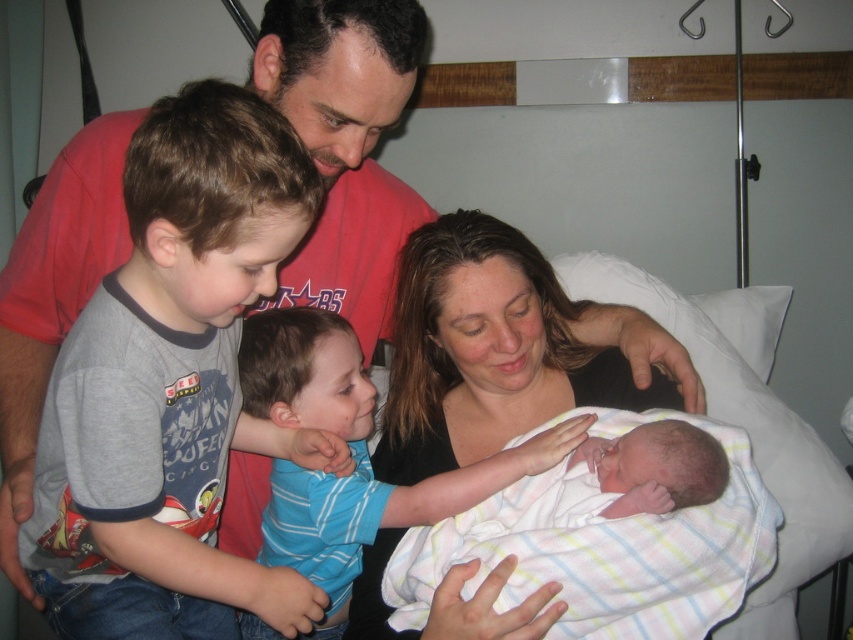
Can you confirm if gray cotton shirt at left is thinner than blue striped shirt at center?

Indeed, gray cotton shirt at left has a lesser width compared to blue striped shirt at center.

Who is more distant from viewer, (x=276, y=616) or (x=349, y=488)?

The point (x=349, y=488) is more distant.

You are a GUI agent. You are given a task and a screenshot of the screen. Output one action in this format:
    pyautogui.click(x=<x>, y=<y>)
    Task: Click on the gray cotton shirt at left
    
    Given the screenshot: What is the action you would take?
    pyautogui.click(x=169, y=385)

Does point (293, 602) lie behind point (410, 620)?

That is False.

Can you confirm if gray cotton shirt at left is thinner than soft white swaddling blanket at center?

Indeed, gray cotton shirt at left has a lesser width compared to soft white swaddling blanket at center.

The image size is (853, 640). Describe the element at coordinates (169, 385) in the screenshot. I see `gray cotton shirt at left` at that location.

Where is `gray cotton shirt at left`? gray cotton shirt at left is located at coordinates (169, 385).

Is point (428, 342) farther from viewer compared to point (407, 579)?

Yes, point (428, 342) is farther from viewer.

Consider the image. Does smooth black shirt at center lie in front of soft white swaddling blanket at center?

No.

Find the location of `smooth black shirt at center`. smooth black shirt at center is located at coordinates (489, 349).

The height and width of the screenshot is (640, 853). Find the location of `smooth black shirt at center`. smooth black shirt at center is located at coordinates (489, 349).